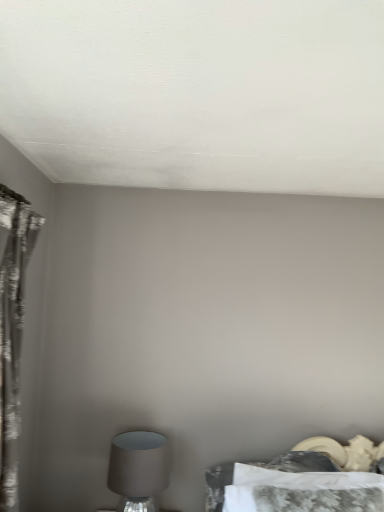
Question: From a real-world perspective, is camouflage-patterned bed at lower right located higher than matte gray lampshade at lower left?

Choices:
 (A) no
 (B) yes

Answer: (B)

Question: Considering the relative positions of camouflage-patterned bed at lower right and matte gray lampshade at lower left in the image provided, is camouflage-patterned bed at lower right to the left of matte gray lampshade at lower left from the viewer's perspective?

Choices:
 (A) yes
 (B) no

Answer: (B)

Question: Would you consider camouflage-patterned bed at lower right to be distant from matte gray lampshade at lower left?

Choices:
 (A) yes
 (B) no

Answer: (B)

Question: Is camouflage-patterned bed at lower right bigger than matte gray lampshade at lower left?

Choices:
 (A) yes
 (B) no

Answer: (A)

Question: Is camouflage-patterned bed at lower right taller than matte gray lampshade at lower left?

Choices:
 (A) no
 (B) yes

Answer: (A)

Question: Considering the positions of camouflage-patterned bed at lower right and matte gray lampshade at lower left in the image, is camouflage-patterned bed at lower right taller or shorter than matte gray lampshade at lower left?

Choices:
 (A) short
 (B) tall

Answer: (A)

Question: Is point (243, 500) positioned closer to the camera than point (142, 450)?

Choices:
 (A) closer
 (B) farther

Answer: (A)

Question: In terms of size, does camouflage-patterned bed at lower right appear bigger or smaller than matte gray lampshade at lower left?

Choices:
 (A) big
 (B) small

Answer: (A)

Question: From the image's perspective, is camouflage-patterned bed at lower right located above or below matte gray lampshade at lower left?

Choices:
 (A) above
 (B) below

Answer: (A)

Question: From their relative heights in the image, would you say silvery textured curtain at left is taller or shorter than camouflage-patterned bed at lower right?

Choices:
 (A) short
 (B) tall

Answer: (B)

Question: Looking at their shapes, would you say silvery textured curtain at left is wider or thinner than camouflage-patterned bed at lower right?

Choices:
 (A) wide
 (B) thin

Answer: (B)

Question: Looking at the image, does silvery textured curtain at left seem bigger or smaller compared to camouflage-patterned bed at lower right?

Choices:
 (A) big
 (B) small

Answer: (A)

Question: Is point (3, 324) closer or farther from the camera than point (284, 487)?

Choices:
 (A) farther
 (B) closer

Answer: (B)

Question: From the image's perspective, relative to silvery textured curtain at left, is matte gray lampshade at lower left above or below?

Choices:
 (A) below
 (B) above

Answer: (A)

Question: Is point (144, 458) closer or farther from the camera than point (0, 211)?

Choices:
 (A) farther
 (B) closer

Answer: (A)